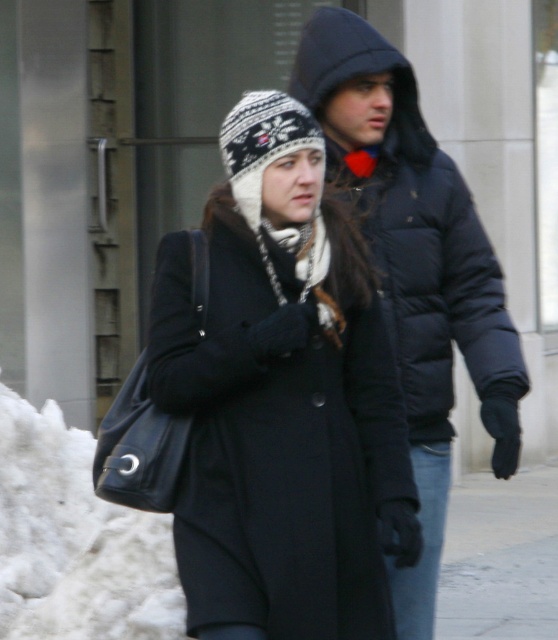
You are standing in the scene and want to reach the point located at coordinates point (151, 333). If you take a step forward of 1 meter, will you be closer to the point?

The point (151, 333) is 5.09 meters from viewer. Taking a step forward of 1 meter will reduce the distance to 4.09 meters, so yes, you will be closer to the point.

You are a delivery drone trying to drop off a package to the person wearing the matte black coat at center. The delivery zone is a 0.1 meter radius around the coordinates point. Can you confirm if the coordinates point is within the delivery zone?

The matte black coat at center is located at point (281, 397). Since the delivery zone is a 0.1 meter radius around the coordinates point, the drone can confirm that the coordinates point is within the delivery zone.